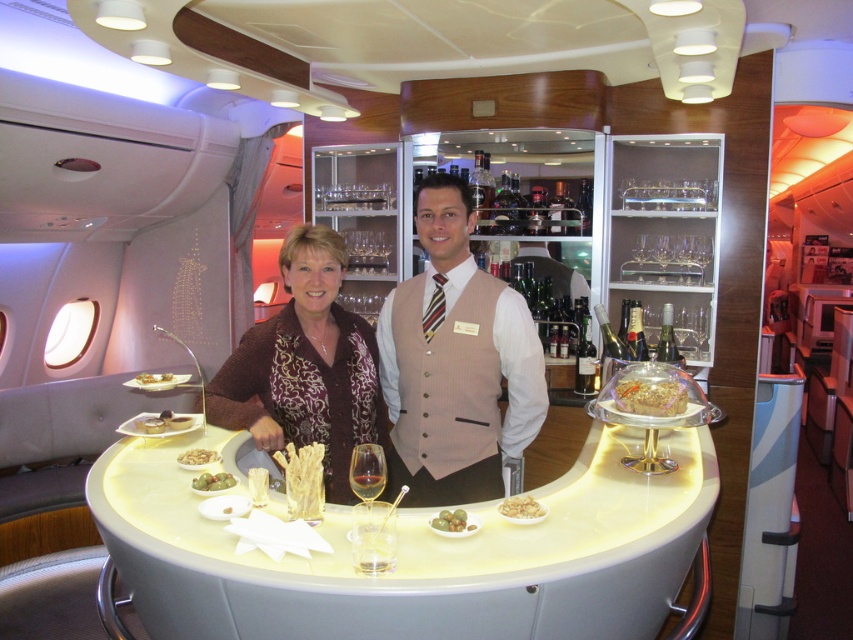
Can you confirm if translucent glass dish at center is shorter than translucent glass wine glass at center?

Indeed, translucent glass dish at center has a lesser height compared to translucent glass wine glass at center.

Which is more to the left, translucent glass dish at center or translucent glass wine glass at center?

Positioned to the left is translucent glass wine glass at center.

At what (x,y) coordinates should I click in order to perform the action: click on translucent glass dish at center. Please return your answer as a coordinate pair (x, y). Looking at the image, I should click on (650, 396).

Who is lower down, brown printed fabric at center or green matte olives at center?

green matte olives at center is lower down.

Who is more forward, (311, 232) or (445, 509)?

Point (445, 509) is in front.

Identify the location of brown printed fabric at center. Image resolution: width=853 pixels, height=640 pixels. (305, 365).

Between point (308, 512) and point (437, 518), which one is positioned in front?

Point (437, 518)

I want to click on golden textured breadsticks at center, so pos(303,481).

Between point (299, 474) and point (456, 525), which one is positioned behind?

Positioned behind is point (299, 474).

You are a GUI agent. You are given a task and a screenshot of the screen. Output one action in this format:
    pyautogui.click(x=<x>, y=<y>)
    Task: Click on the golden textured breadsticks at center
    
    Given the screenshot: What is the action you would take?
    pyautogui.click(x=303, y=481)